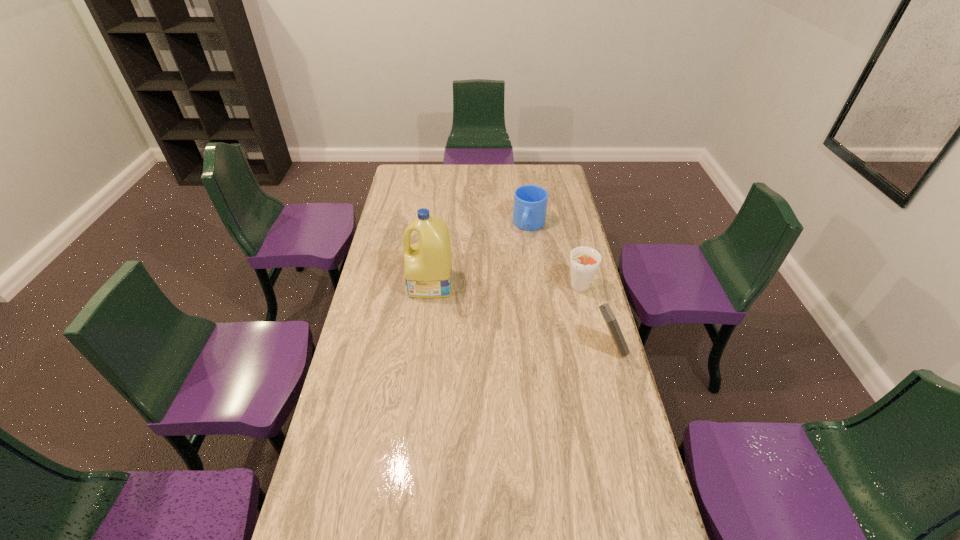
This screenshot has width=960, height=540. Identify the location of vacant space at the right edge of the desktop. tap(627, 410).

Where is `blank space at the far right corner`? blank space at the far right corner is located at coordinates (537, 183).

The image size is (960, 540). In order to click on vacant space that is in between the mug and the root beer in this screenshot , I will do `click(554, 256)`.

Find the location of a particular element. This screenshot has width=960, height=540. free spot between the tallest object and the shortest object is located at coordinates (480, 255).

The height and width of the screenshot is (540, 960). Identify the location of vacant space that is in between the third object from right to left and the detergent. (480, 255).

Where is `vacant space that's between the calculator and the root beer`? vacant space that's between the calculator and the root beer is located at coordinates click(x=594, y=318).

Locate an element on the screen. This screenshot has height=540, width=960. blank region between the detergent and the calculator is located at coordinates click(520, 316).

Locate an element on the screen. The image size is (960, 540). free spot between the farthest object and the detergent is located at coordinates (480, 255).

You are a GUI agent. You are given a task and a screenshot of the screen. Output one action in this format:
    pyautogui.click(x=<x>, y=<y>)
    Task: Click on the empty space that is in between the detergent and the third object from right to left
    This screenshot has width=960, height=540.
    Given the screenshot: What is the action you would take?
    pyautogui.click(x=480, y=255)

This screenshot has height=540, width=960. I want to click on free spot between the shortest object and the detergent, so click(480, 255).